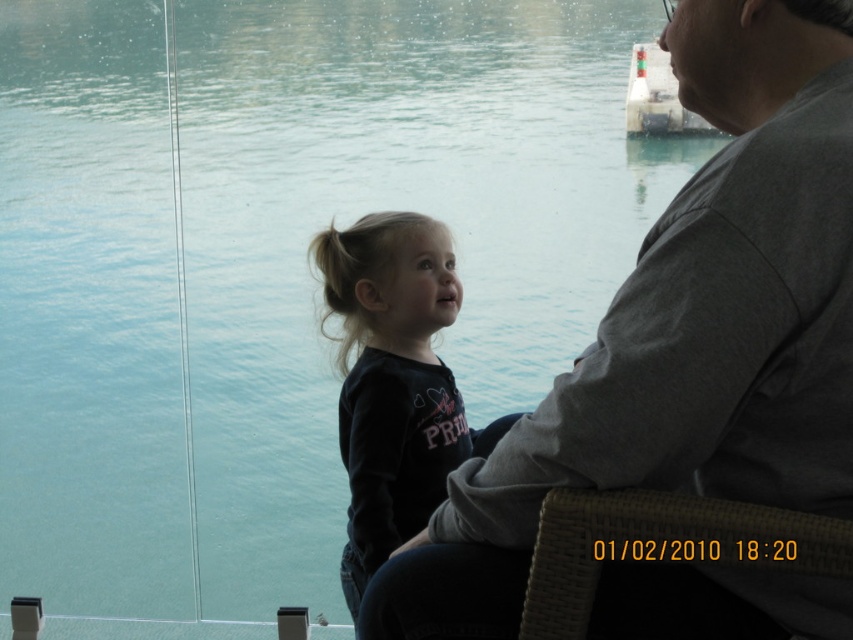
Can you confirm if woven brown chair at lower right is shorter than green striped buoy at upper right?

Yes, woven brown chair at lower right is shorter than green striped buoy at upper right.

Does woven brown chair at lower right have a greater width compared to green striped buoy at upper right?

Correct, the width of woven brown chair at lower right exceeds that of green striped buoy at upper right.

The height and width of the screenshot is (640, 853). Find the location of `woven brown chair at lower right`. woven brown chair at lower right is located at coordinates (660, 547).

Is black matte shirt at center further to camera compared to green striped buoy at upper right?

No, it is not.

Between black matte shirt at center and green striped buoy at upper right, which one is positioned higher?

green striped buoy at upper right is above.

Is point (433, 268) positioned before point (634, 124)?

Yes, it is in front of point (634, 124).

Where is `black matte shirt at center`? The height and width of the screenshot is (640, 853). black matte shirt at center is located at coordinates (392, 380).

Find the location of a particular element. Image resolution: width=853 pixels, height=640 pixels. gray fabric shirt at upper right is located at coordinates (685, 332).

Can you confirm if gray fabric shirt at upper right is positioned above green striped buoy at upper right?

Incorrect, gray fabric shirt at upper right is not positioned above green striped buoy at upper right.

Which is behind, point (566, 445) or point (660, 97)?

Point (660, 97)

Locate an element on the screen. gray fabric shirt at upper right is located at coordinates (685, 332).